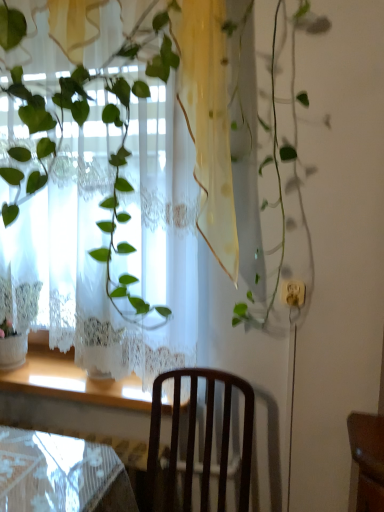
Question: Is white lace curtain at upper left to the right of wooden at lower left from the viewer's perspective?

Choices:
 (A) no
 (B) yes

Answer: (B)

Question: Can you confirm if white lace curtain at upper left is bigger than wooden at lower left?

Choices:
 (A) no
 (B) yes

Answer: (B)

Question: Is white lace curtain at upper left positioned with its back to wooden at lower left?

Choices:
 (A) yes
 (B) no

Answer: (A)

Question: Is white lace curtain at upper left positioned far away from wooden at lower left?

Choices:
 (A) yes
 (B) no

Answer: (B)

Question: Considering the relative sizes of white lace curtain at upper left and wooden at lower left in the image provided, is white lace curtain at upper left taller than wooden at lower left?

Choices:
 (A) yes
 (B) no

Answer: (A)

Question: From the image's perspective, is wooden at lower left positioned above or below dark wood chair at center?

Choices:
 (A) above
 (B) below

Answer: (A)

Question: Is point (23, 373) closer or farther from the camera than point (155, 446)?

Choices:
 (A) closer
 (B) farther

Answer: (B)

Question: Looking at the image, does wooden at lower left seem bigger or smaller compared to dark wood chair at center?

Choices:
 (A) big
 (B) small

Answer: (B)

Question: In terms of width, does wooden at lower left look wider or thinner when compared to dark wood chair at center?

Choices:
 (A) wide
 (B) thin

Answer: (B)

Question: From the image's perspective, is white lace curtain at upper left above or below dark wood chair at center?

Choices:
 (A) below
 (B) above

Answer: (B)

Question: From a real-world perspective, is white lace curtain at upper left physically located above or below dark wood chair at center?

Choices:
 (A) below
 (B) above

Answer: (B)

Question: Is white lace curtain at upper left wider or thinner than dark wood chair at center?

Choices:
 (A) wide
 (B) thin

Answer: (B)

Question: Considering the positions of point (51, 116) and point (205, 468), is point (51, 116) closer or farther from the camera than point (205, 468)?

Choices:
 (A) farther
 (B) closer

Answer: (B)

Question: Do you think dark wood chair at center is within white lace curtain at upper left, or outside of it?

Choices:
 (A) inside
 (B) outside

Answer: (B)

Question: From their relative heights in the image, would you say dark wood chair at center is taller or shorter than white lace curtain at upper left?

Choices:
 (A) tall
 (B) short

Answer: (B)